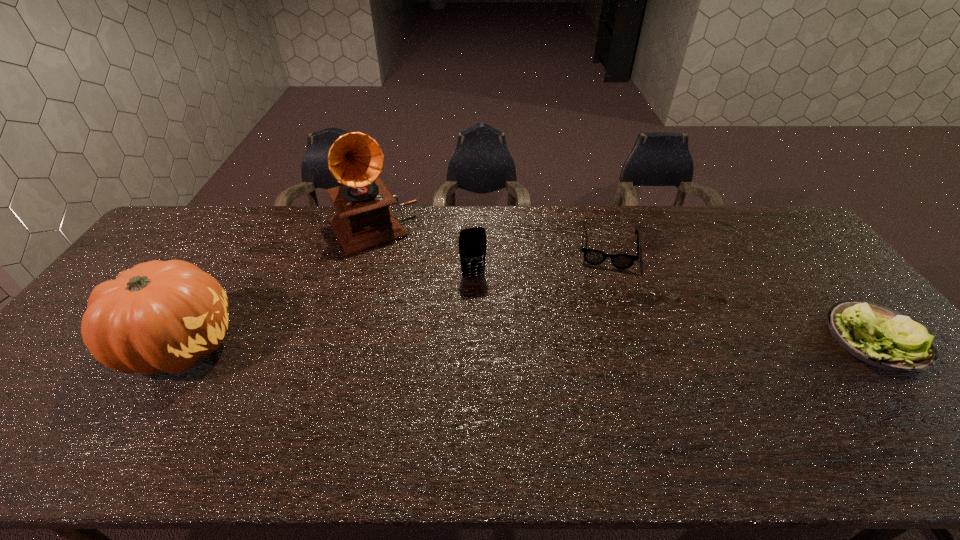
Identify the location of vacant space that is in between the shortest object and the rightmost object. (741, 294).

The height and width of the screenshot is (540, 960). Identify the location of vacant area that lies between the fourth tallest object and the shortest object. (741, 294).

The image size is (960, 540). In order to click on free area in between the spectacles and the second object from left to right in this screenshot , I will do `click(490, 239)`.

At what (x,y) coordinates should I click in order to perform the action: click on vacant point located between the fourth object from left to right and the third shortest object. Please return your answer as a coordinate pair (x, y). The height and width of the screenshot is (540, 960). Looking at the image, I should click on point(540,263).

You are a GUI agent. You are given a task and a screenshot of the screen. Output one action in this format:
    pyautogui.click(x=<x>, y=<y>)
    Task: Click on the free spot between the tallest object and the leftmost object
    
    Given the screenshot: What is the action you would take?
    pos(276,287)

Find the location of `vacant area between the tallest object and the leftmost object`. vacant area between the tallest object and the leftmost object is located at coordinates (276, 287).

Locate an element on the screen. empty space between the second object from right to left and the lettuce is located at coordinates (741, 294).

Where is `free spot between the fourth object from left to right and the phonograph record`? The height and width of the screenshot is (540, 960). free spot between the fourth object from left to right and the phonograph record is located at coordinates (490, 239).

You are a GUI agent. You are given a task and a screenshot of the screen. Output one action in this format:
    pyautogui.click(x=<x>, y=<y>)
    Task: Click on the free spot between the phonograph record and the third shortest object
    Image resolution: width=960 pixels, height=540 pixels.
    Given the screenshot: What is the action you would take?
    pyautogui.click(x=422, y=253)

At what (x,y) coordinates should I click in order to perform the action: click on free spot between the lettuce and the fourth object from right to left. Please return your answer as a coordinate pair (x, y). Looking at the image, I should click on (623, 284).